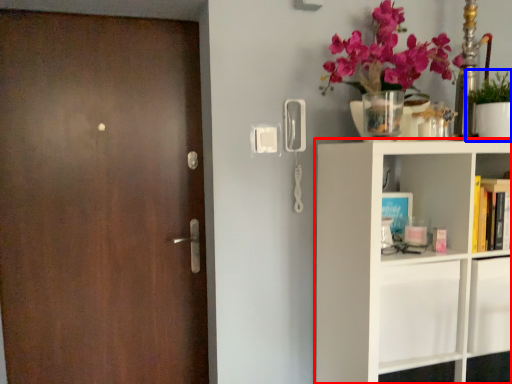
Question: Which point is further to the camera, shelf (highlighted by a red box) or houseplant (highlighted by a blue box)?

Choices:
 (A) shelf
 (B) houseplant

Answer: (B)